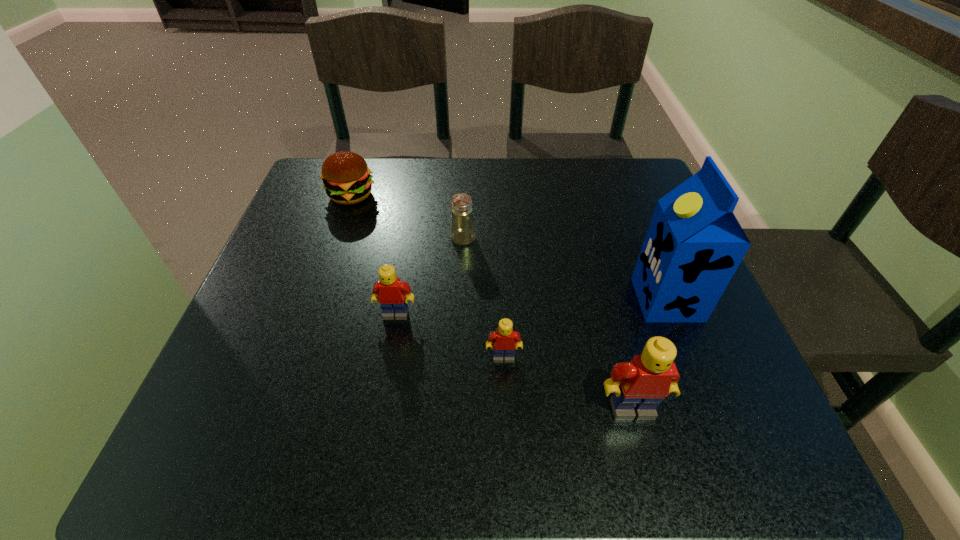
You are a GUI agent. You are given a task and a screenshot of the screen. Output one action in this format:
    pyautogui.click(x=<x>, y=<y>)
    Task: Click on the Lego that stands as the closest to the leftmost Lego
    The width and height of the screenshot is (960, 540).
    Given the screenshot: What is the action you would take?
    pyautogui.click(x=504, y=340)